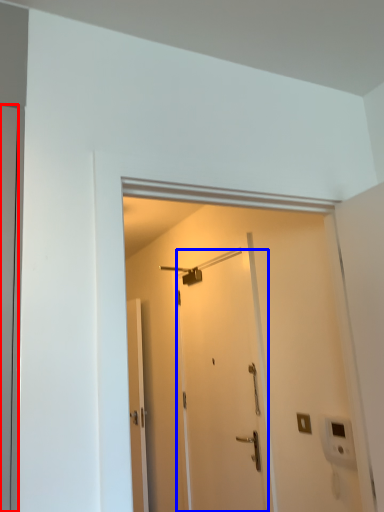
Question: Which point is closer to the camera, door (highlighted by a red box) or door (highlighted by a blue box)?

Choices:
 (A) door
 (B) door

Answer: (A)